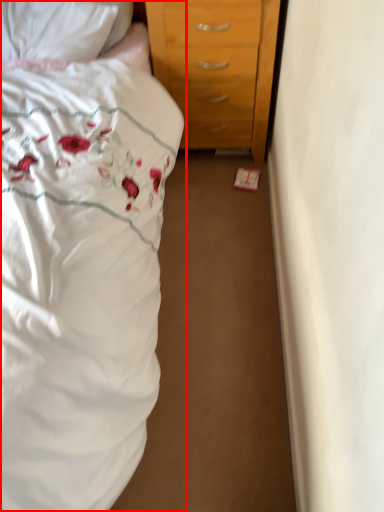
Question: From the image's perspective, where is bed (annotated by the red box) located relative to pillow?

Choices:
 (A) above
 (B) below

Answer: (B)